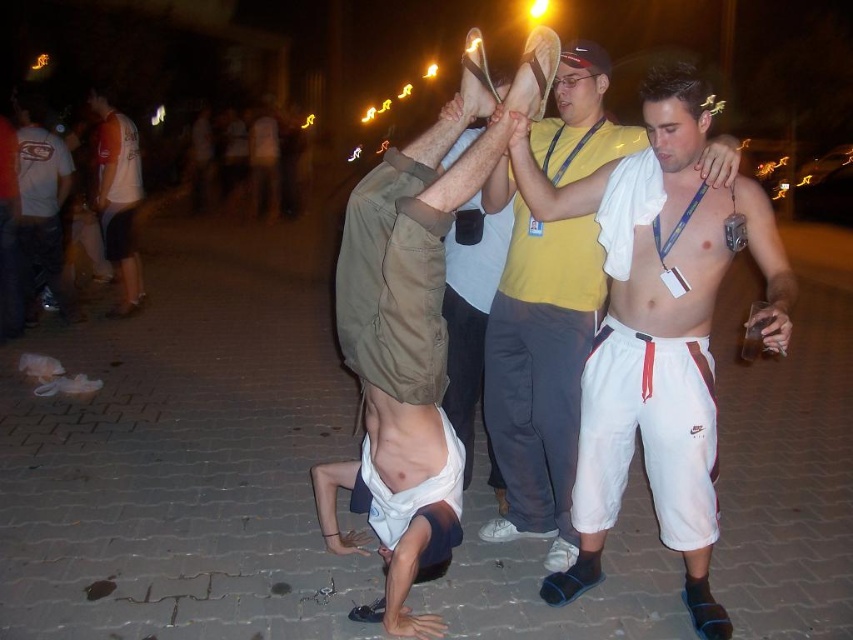
Question: Is tan cotton shirt at center below white cotton shirt at upper left?

Choices:
 (A) no
 (B) yes

Answer: (B)

Question: Among these points, which one is nearest to the camera?

Choices:
 (A) (412, 531)
 (B) (117, 218)

Answer: (A)

Question: Considering the relative positions of tan cotton shirt at center and white cotton shorts at center in the image provided, where is tan cotton shirt at center located with respect to white cotton shorts at center?

Choices:
 (A) above
 (B) below

Answer: (B)

Question: Is the position of white cotton shorts at center less distant than that of white cotton shirt at left?

Choices:
 (A) no
 (B) yes

Answer: (B)

Question: Which of these objects is positioned closest to the tan cotton shirt at center?

Choices:
 (A) white cotton shirt at upper left
 (B) white cotton shorts at center

Answer: (B)

Question: Which is farther from the white cotton shirt at left?

Choices:
 (A) white cotton shorts at center
 (B) tan cotton shirt at center
 (C) white cotton shirt at upper left

Answer: (A)